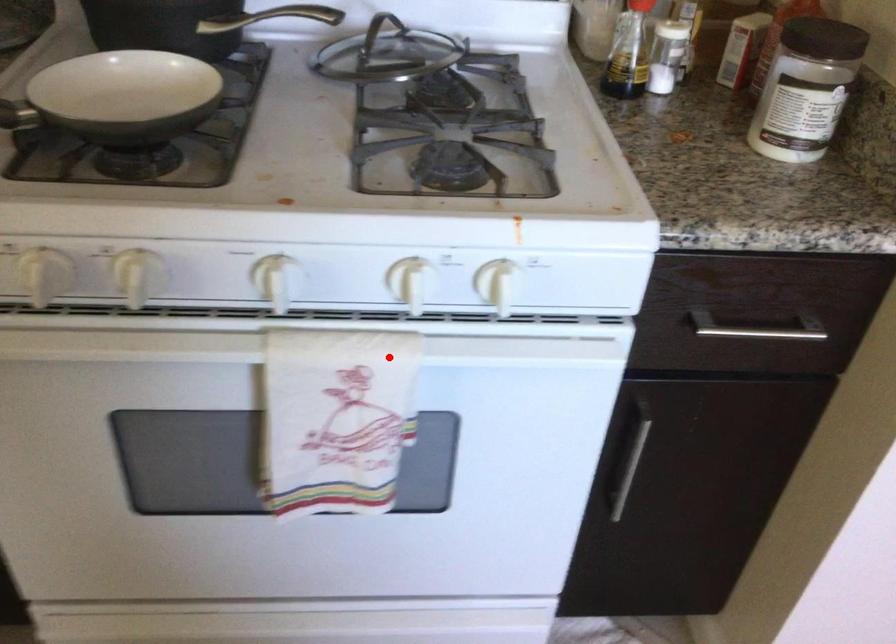
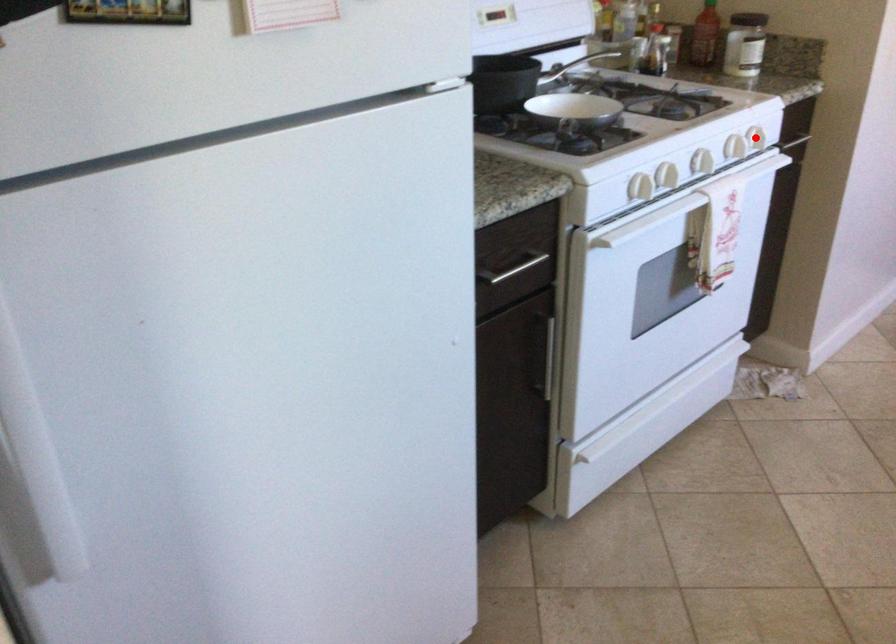
I am providing you with two images of the same scene from different viewpoints. A red point is marked on the first image and another point is marked on the second image. Are the points marked in image1 and image2 representing the same 3D position?

Yes